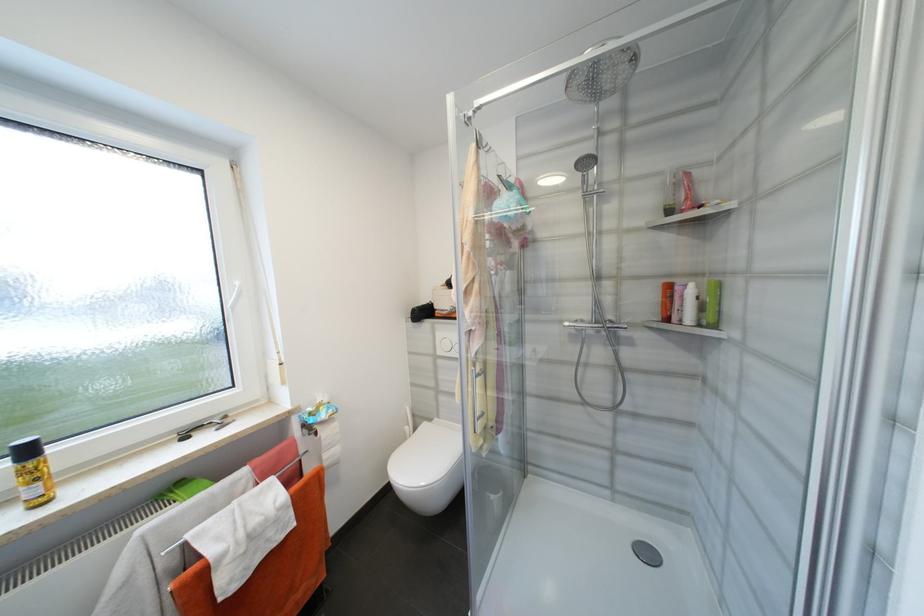
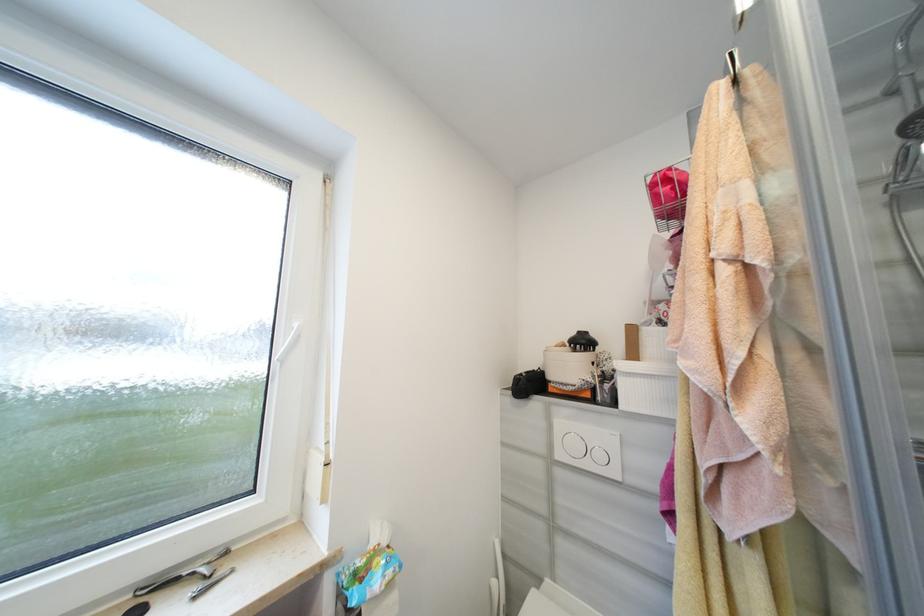
The images are taken continuously from a first-person perspective. In which direction are you moving?

The movement direction of the cameraman is left, forward.